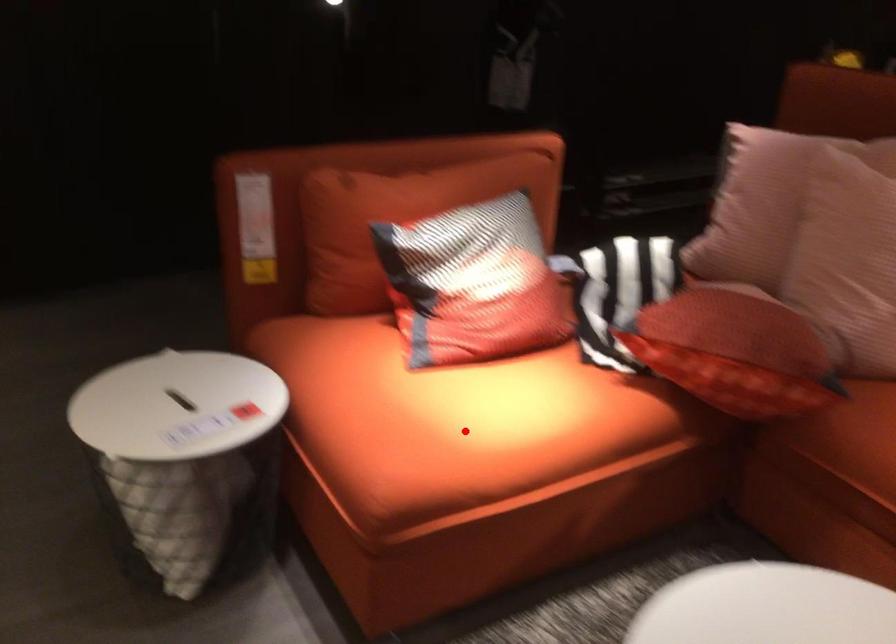
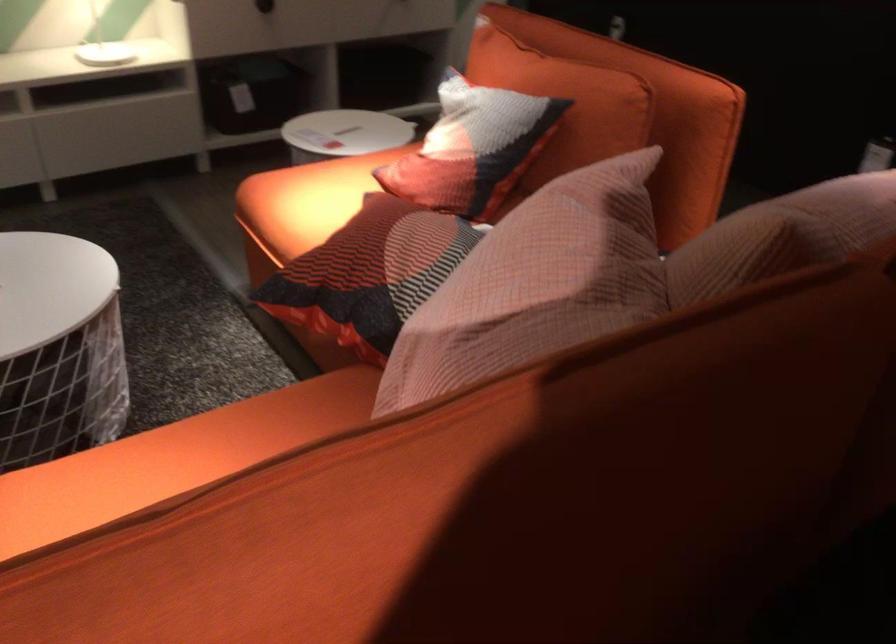
Question: A red point is marked in image1. In image2, is the corresponding 3D point closer to the camera or farther? Reply with the corresponding letter.

Choices:
 (A) The corresponding 3D point is closer.
 (B) The corresponding 3D point is farther.

Answer: (B)